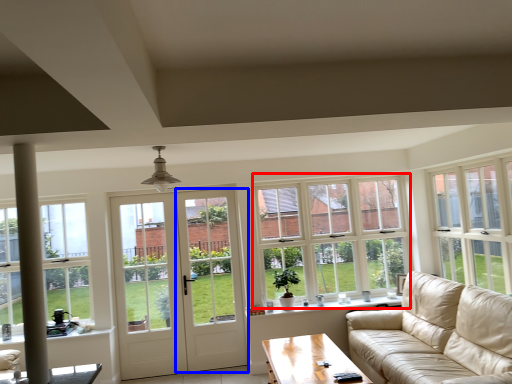
Question: Which object is further to the camera taking this photo, window (highlighted by a red box) or screen door (highlighted by a blue box)?

Choices:
 (A) window
 (B) screen door

Answer: (A)